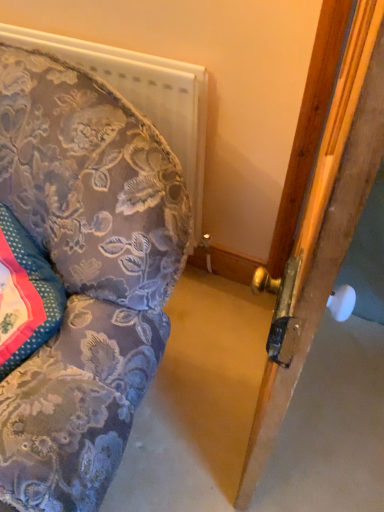
Where is `floral fabric couch at left`? This screenshot has height=512, width=384. floral fabric couch at left is located at coordinates (85, 275).

The height and width of the screenshot is (512, 384). Describe the element at coordinates (85, 275) in the screenshot. I see `floral fabric couch at left` at that location.

Locate an element on the screen. The image size is (384, 512). floral fabric couch at left is located at coordinates (85, 275).